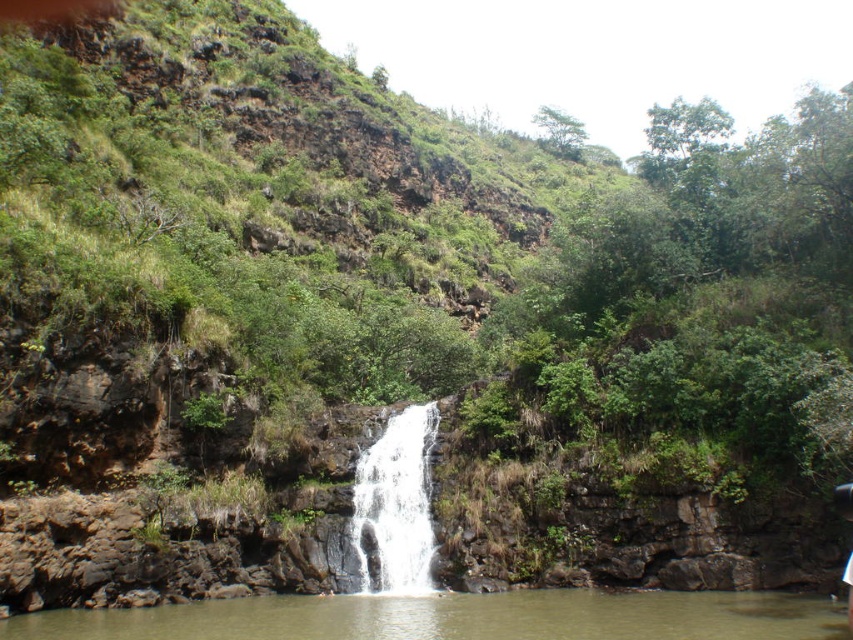
You are standing at the edge of the cliff overlooking the scene. You see the green translucent water at center and the white smooth waterfall at center. Which one is located lower in the image?

The green translucent water at center is located lower than the white smooth waterfall at center because it is positioned below it.

You are standing at the edge of the cliff overlooking the waterfall. You want to throw a pebble into the green translucent water at center. To ensure it lands in the water, in which direction should you aim relative to your position?

You should aim towards the center of the waterfall where the green translucent water at center is located, as that is the area directly below the waterfall where the water pools.